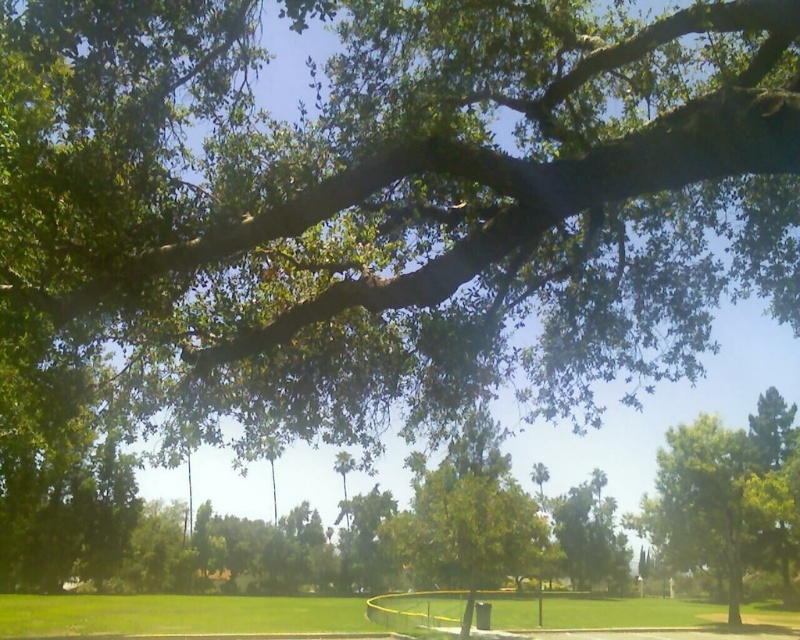
Question: Is green leafy tree at center below green grass at lower center?

Choices:
 (A) no
 (B) yes

Answer: (A)

Question: Does green leafy tree at center appear under green grass at lower center?

Choices:
 (A) yes
 (B) no

Answer: (B)

Question: Which of the following is the farthest from the observer?

Choices:
 (A) (668, 618)
 (B) (738, 456)

Answer: (A)

Question: Does green leafy tree at center have a smaller size compared to green grass at lower center?

Choices:
 (A) no
 (B) yes

Answer: (B)

Question: Which object appears closest to the camera in this image?

Choices:
 (A) green grass at lower center
 (B) green leafy tree at center

Answer: (A)

Question: Which of the following is the closest to the observer?

Choices:
 (A) (754, 442)
 (B) (241, 596)

Answer: (A)